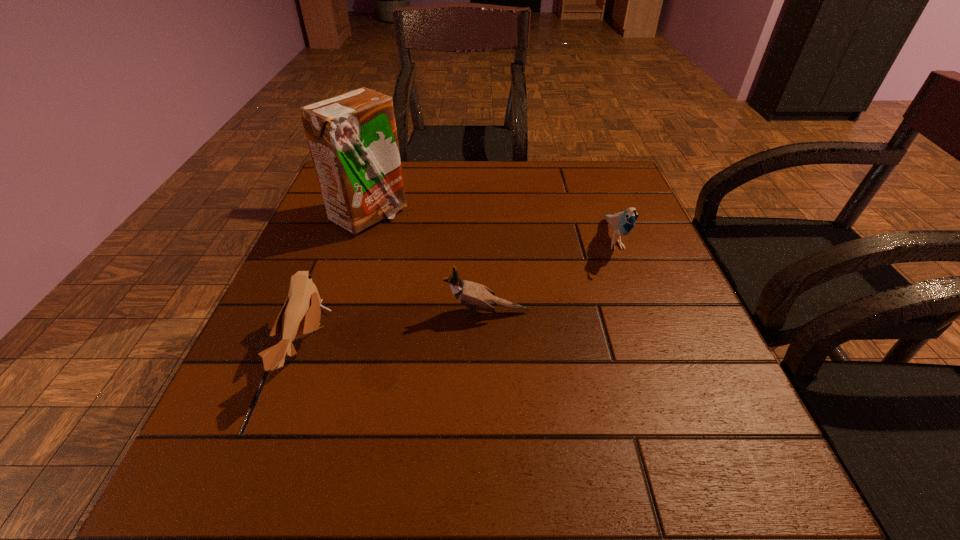
Choose which object is the second nearest neighbor to the second bird from left to right. Please provide its 2D coordinates. Your answer should be formatted as a tuple, i.e. [(x, y)], where the tuple contains the x and y coordinates of a point satisfying the conditions above.

[(622, 223)]

Locate an element on the screen. Image resolution: width=960 pixels, height=540 pixels. the closest object to the farthest bird is located at coordinates (474, 295).

Where is `the second closest bird to the second bird from right to left`? This screenshot has height=540, width=960. the second closest bird to the second bird from right to left is located at coordinates (622, 223).

Identify which bird is located as the second nearest to the carton. Please provide its 2D coordinates. Your answer should be formatted as a tuple, i.e. [(x, y)], where the tuple contains the x and y coordinates of a point satisfying the conditions above.

[(474, 295)]

This screenshot has width=960, height=540. I want to click on blank area in the image that satisfies the following two spatial constraints: 1. at the face of the rightmost bird; 2. at the beak of the leftmost bird, so click(x=654, y=347).

This screenshot has height=540, width=960. Identify the location of free space that satisfies the following two spatial constraints: 1. at the face of the rightmost bird; 2. at the beak of the leftmost bird. (654, 347).

Locate an element on the screen. free space that satisfies the following two spatial constraints: 1. at the face of the farthest bird; 2. at the beak of the leftmost bird is located at coordinates (654, 347).

Find the location of `free space that satisfies the following two spatial constraints: 1. at the face of the rightmost bird; 2. at the face of the second object from right to left`. free space that satisfies the following two spatial constraints: 1. at the face of the rightmost bird; 2. at the face of the second object from right to left is located at coordinates (641, 312).

Where is `free spot that satisfies the following two spatial constraints: 1. at the face of the farthest bird; 2. at the beak of the leftmost bird`? Image resolution: width=960 pixels, height=540 pixels. free spot that satisfies the following two spatial constraints: 1. at the face of the farthest bird; 2. at the beak of the leftmost bird is located at coordinates (654, 347).

Image resolution: width=960 pixels, height=540 pixels. Find the location of `free spot that satisfies the following two spatial constraints: 1. at the face of the rightmost object; 2. at the beak of the leftmost bird`. free spot that satisfies the following two spatial constraints: 1. at the face of the rightmost object; 2. at the beak of the leftmost bird is located at coordinates (654, 347).